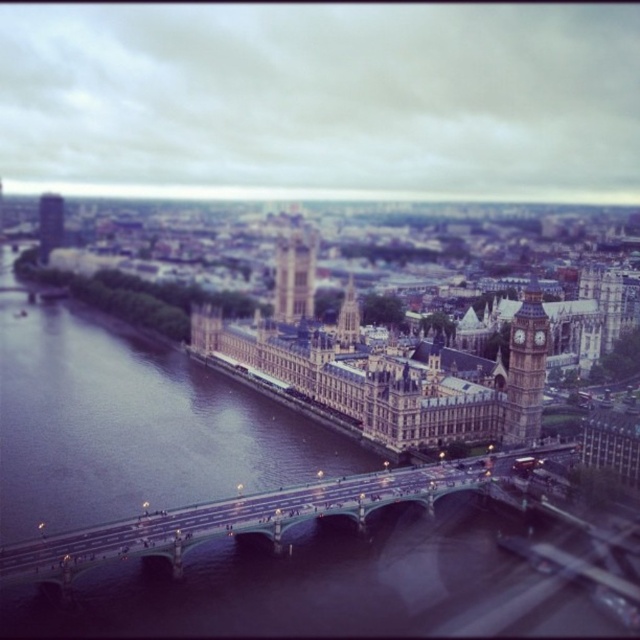
You are a drone operator tasked with flying a drone from the metallic gray bridge at center to the stone clock tower at right. The drone has a maximum flight range of 50 meters. Can the drone complete the journey without needing to recharge?

The distance between the metallic gray bridge at center and the stone clock tower at right is 46.28 meters, which is within the drone operator s 50 meter range. The drone can complete the journey without needing to recharge.

You are a tourist in London and want to take a photo of both the stone clock tower at center and the golden stone big ben at upper left. Which one should you zoom in on more to ensure both are in frame?

Since the stone clock tower at center is taller than golden stone big ben at upper left, you should zoom in more on the stone clock tower at center to ensure both are in frame.